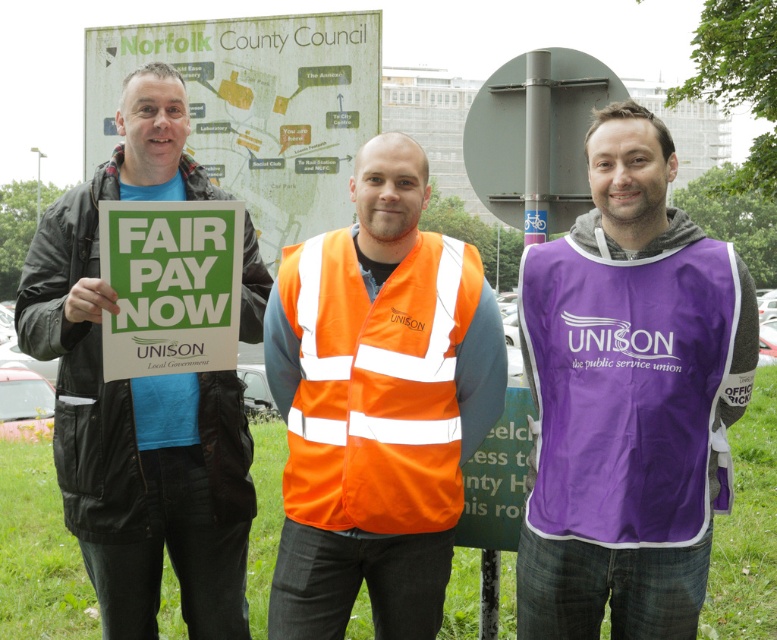
Where is `purple fabric vest at center`? purple fabric vest at center is located at coordinates (629, 397).

Which is in front, point (645, 273) or point (338, 316)?

Positioned in front is point (645, 273).

At what (x,y) coordinates should I click in order to perform the action: click on purple fabric vest at center. Please return your answer as a coordinate pair (x, y). Looking at the image, I should click on (629, 397).

Is matte black jacket at left to the left of orange reflective safety vest at center from the viewer's perspective?

Indeed, matte black jacket at left is positioned on the left side of orange reflective safety vest at center.

Is matte black jacket at left smaller than orange reflective safety vest at center?

Incorrect, matte black jacket at left is not smaller in size than orange reflective safety vest at center.

Which is in front, point (138, 109) or point (448, 330)?

Point (448, 330) is more forward.

Find the location of a particular element. matte black jacket at left is located at coordinates (138, 401).

Between purple fabric vest at center and matte black jacket at left, which one is positioned lower?

Positioned lower is matte black jacket at left.

Between purple fabric vest at center and matte black jacket at left, which one is positioned higher?

purple fabric vest at center is higher up.

Is point (542, 461) farther from viewer compared to point (155, 552)?

No.

Locate an element on the screen. This screenshot has width=777, height=640. purple fabric vest at center is located at coordinates (629, 397).